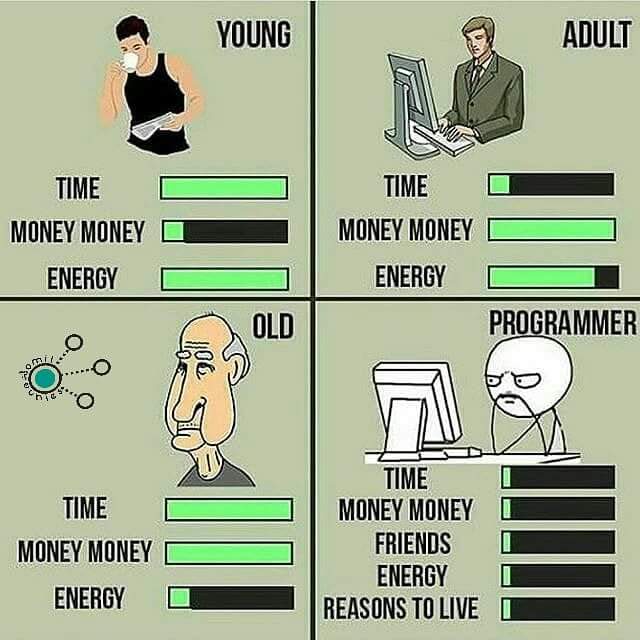
Where is `monitor`? Image resolution: width=640 pixels, height=640 pixels. monitor is located at coordinates (420, 77).